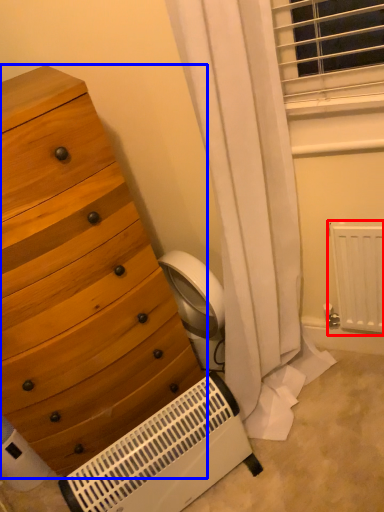
Question: Among these objects, which one is farthest to the camera, radiator (highlighted by a red box) or chest of drawers (highlighted by a blue box)?

Choices:
 (A) radiator
 (B) chest of drawers

Answer: (A)